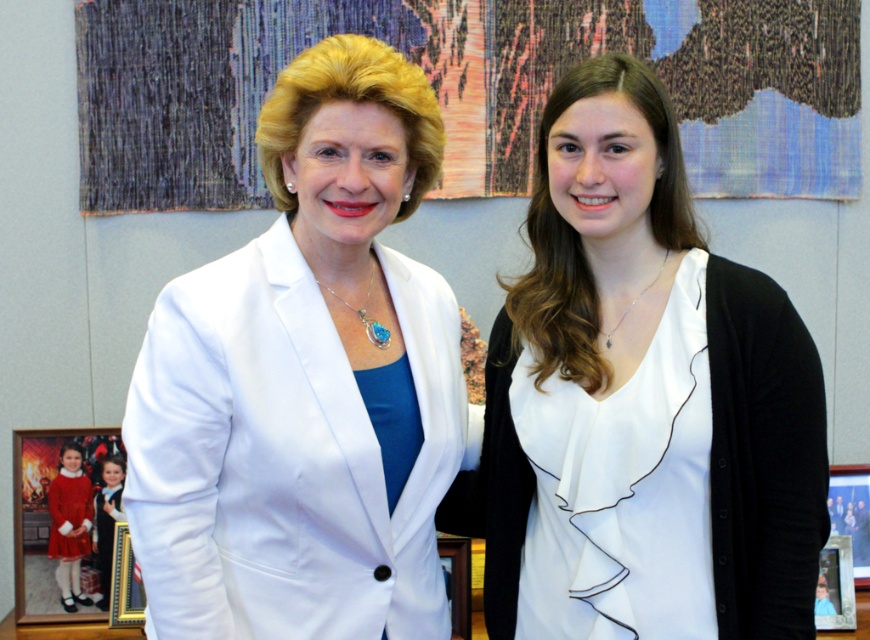
Is point (606, 605) positioned after point (178, 460)?

Yes, it is.

Is white matte blouse at center to the left of white smooth blazer at center from the viewer's perspective?

Incorrect, white matte blouse at center is not on the left side of white smooth blazer at center.

Locate an element on the screen. This screenshot has height=640, width=870. white matte blouse at center is located at coordinates (641, 401).